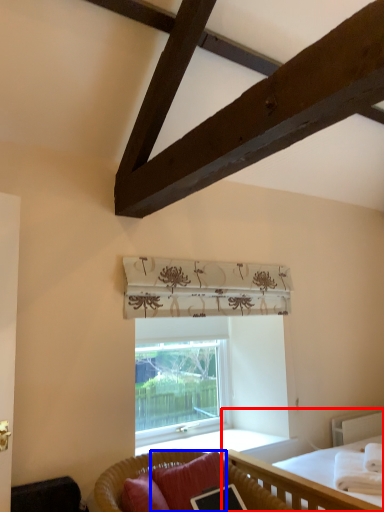
Question: Which object is closer to the camera taking this photo, bed (highlighted by a red box) or pillow (highlighted by a blue box)?

Choices:
 (A) bed
 (B) pillow

Answer: (A)